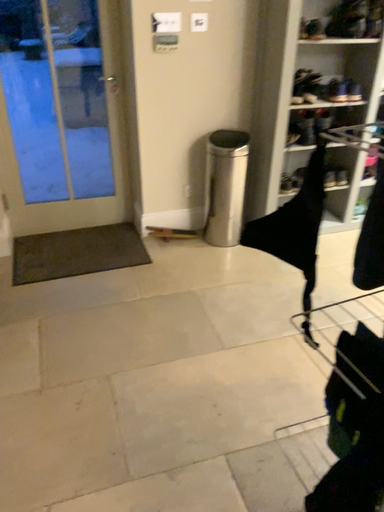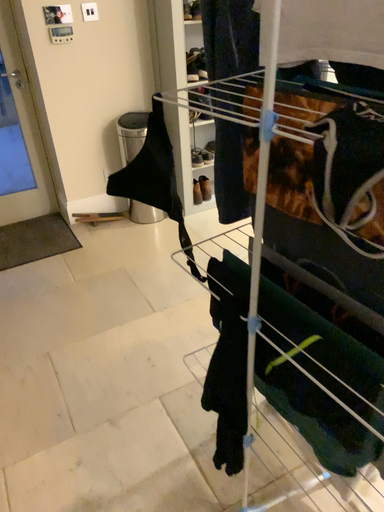
Question: How did the camera likely rotate when shooting the video?

Choices:
 (A) rotated left
 (B) rotated right

Answer: (B)